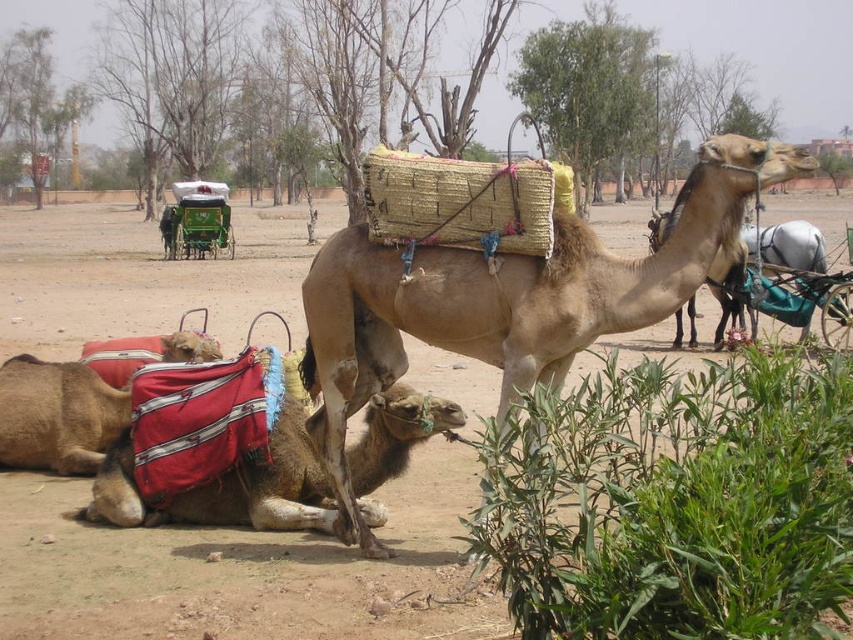
Question: Which point is farther from the camera taking this photo?

Choices:
 (A) (196, 492)
 (B) (473, 372)
 (C) (374, 330)

Answer: (B)

Question: Among these objects, which one is nearest to the camera?

Choices:
 (A) brown dirt field at center
 (B) light brown camel at center

Answer: (A)

Question: Which object appears farthest from the camera in this image?

Choices:
 (A) red fabric camel at lower left
 (B) light brown camel at center
 (C) brown dirt field at center

Answer: (A)

Question: Does brown dirt field at center appear under light brown camel at center?

Choices:
 (A) yes
 (B) no

Answer: (B)

Question: Can you confirm if brown dirt field at center is smaller than light brown camel at center?

Choices:
 (A) yes
 (B) no

Answer: (B)

Question: Does brown dirt field at center have a smaller size compared to light brown camel at center?

Choices:
 (A) yes
 (B) no

Answer: (B)